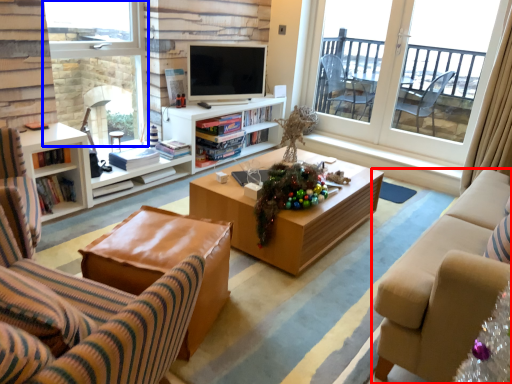
Question: Which object appears farthest to the camera in this image, studio couch (highlighted by a red box) or window (highlighted by a blue box)?

Choices:
 (A) studio couch
 (B) window

Answer: (B)